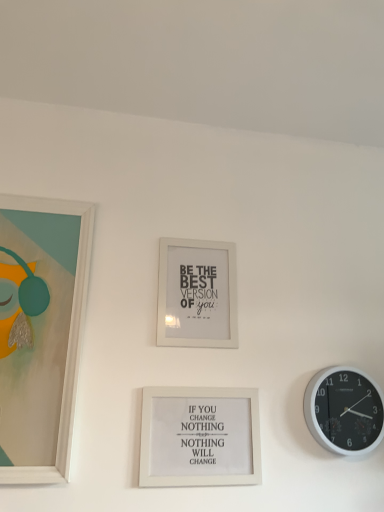
Question: Is matte white picture frame at left, which appears as the first picture frame when viewed from the left, taller or shorter than black plastic wall clock at right?

Choices:
 (A) tall
 (B) short

Answer: (A)

Question: Is point (11, 394) closer or farther from the camera than point (362, 452)?

Choices:
 (A) farther
 (B) closer

Answer: (B)

Question: Which object is the farthest from the black plastic wall clock at right?

Choices:
 (A) white matte picture frame at center, the 2th picture frame from the left
 (B) white matte picture frame at center, positioned as the third picture frame in left-to-right order
 (C) matte white picture frame at left, the third picture frame positioned from the right

Answer: (C)

Question: Which of these objects is positioned farthest from the matte white picture frame at left, the third picture frame positioned from the right?

Choices:
 (A) white matte picture frame at center, positioned as the third picture frame in left-to-right order
 (B) white matte picture frame at center, the second picture frame in the right-to-left sequence
 (C) black plastic wall clock at right

Answer: (C)